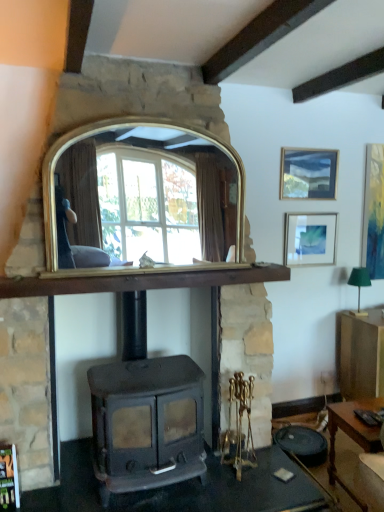
Question: Is wooden mantel at center at the back of matte black wood burning stove at center?

Choices:
 (A) no
 (B) yes

Answer: (A)

Question: Is matte black wood burning stove at center taller than wooden mantel at center?

Choices:
 (A) no
 (B) yes

Answer: (B)

Question: Is there a large distance between matte black wood burning stove at center and wooden mantel at center?

Choices:
 (A) yes
 (B) no

Answer: (B)

Question: From the image's perspective, does matte black wood burning stove at center appear lower than wooden mantel at center?

Choices:
 (A) yes
 (B) no

Answer: (A)

Question: Could you tell me if matte black wood burning stove at center is facing wooden mantel at center?

Choices:
 (A) yes
 (B) no

Answer: (B)

Question: Visually, is matte wooden picture frame at upper right, which appears as the third picture frame when viewed from the right, positioned to the left or to the right of matte gold picture frame at right, the third picture frame when ordered from left to right?

Choices:
 (A) left
 (B) right

Answer: (A)

Question: Considering the positions of matte wooden picture frame at upper right, which appears as the third picture frame when viewed from the right, and matte gold picture frame at right, arranged as the 1th picture frame when viewed from the right, in the image, is matte wooden picture frame at upper right, which appears as the third picture frame when viewed from the right, wider or thinner than matte gold picture frame at right, arranged as the 1th picture frame when viewed from the right,?

Choices:
 (A) wide
 (B) thin

Answer: (A)

Question: Does point tap(284, 166) appear closer or farther from the camera than point tap(379, 159)?

Choices:
 (A) farther
 (B) closer

Answer: (B)

Question: Would you say matte wooden picture frame at upper right, placed as the first picture frame when sorted from left to right, is inside or outside matte gold picture frame at right, arranged as the 1th picture frame when viewed from the right?

Choices:
 (A) outside
 (B) inside

Answer: (A)

Question: From their relative heights in the image, would you say matte silver picture frame at upper right, which is the 2th picture frame in left-to-right order, is taller or shorter than matte wooden picture frame at upper right, placed as the first picture frame when sorted from left to right?

Choices:
 (A) short
 (B) tall

Answer: (B)

Question: Based on their positions, is matte silver picture frame at upper right, arranged as the second picture frame when viewed from the right, located to the left or right of matte wooden picture frame at upper right, which appears as the third picture frame when viewed from the right?

Choices:
 (A) left
 (B) right

Answer: (B)

Question: Considering the positions of point (286, 229) and point (311, 175), is point (286, 229) closer or farther from the camera than point (311, 175)?

Choices:
 (A) farther
 (B) closer

Answer: (B)

Question: In the image, is matte silver picture frame at upper right, which is the 2th picture frame in left-to-right order, positioned in front of or behind matte wooden picture frame at upper right, which appears as the third picture frame when viewed from the right?

Choices:
 (A) behind
 (B) front

Answer: (A)

Question: From the image's perspective, is matte silver picture frame at upper right, which is the 2th picture frame in left-to-right order, above or below matte gold picture frame at right, the third picture frame when ordered from left to right?

Choices:
 (A) below
 (B) above

Answer: (A)

Question: Considering their positions, is matte silver picture frame at upper right, which is the 2th picture frame in left-to-right order, located in front of or behind matte gold picture frame at right, the third picture frame when ordered from left to right?

Choices:
 (A) behind
 (B) front

Answer: (B)